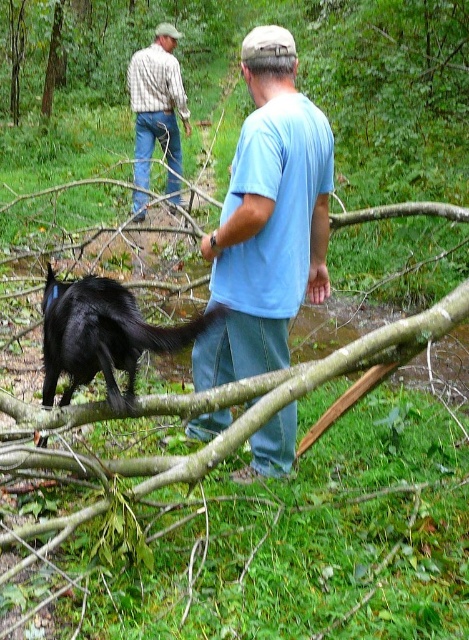
Based on the photo, you are in a forest area with a stream. You see a blue cotton shirt at center. Where is the blue cotton shirt located in the image?

The blue cotton shirt at center is located at point [267,220].

You are a photographer trying to capture a group photo of the two people in the scene. The blue cotton shirt at center and the plaid shirt at upper left are both in the frame. Which person should you adjust to make them appear taller in the photo?

The blue cotton shirt at center is not as tall as plaid shirt at upper left, so you should adjust the blue cotton shirt at center to make it appear taller in the photo.

You are a hiker in the forest and see the shiny black dog at lower left and the plaid shirt at upper left. Which object is closer to the front of the image?

The shiny black dog at lower left is closer to the front of the image because it is positioned under the plaid shirt at upper left, indicating it is in front spatially.